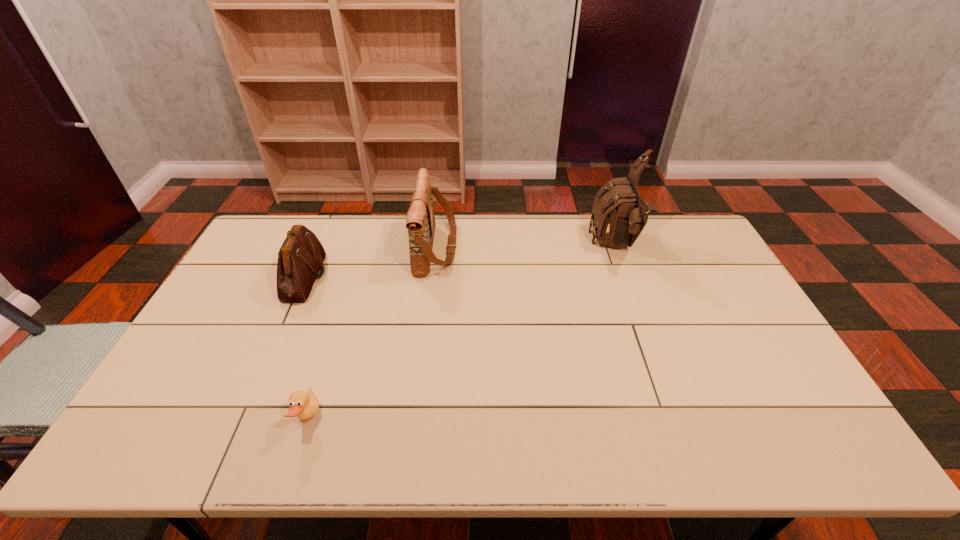
What are the coordinates of `free space located 0.110m on the front-facing side of the rightmost object` in the screenshot? It's located at (561, 246).

The height and width of the screenshot is (540, 960). In order to click on vacant region located 0.350m on the front-facing side of the second tallest shoulder bag in this screenshot , I will do `click(557, 248)`.

Locate an element on the screen. Image resolution: width=960 pixels, height=540 pixels. vacant space located on the front of the leftmost shoulder bag is located at coordinates (251, 403).

At what (x,y) coordinates should I click in order to perform the action: click on blank space located on the beak of the duck. Please return your answer as a coordinate pair (x, y). Looking at the image, I should click on (431, 418).

Locate an element on the screen. object positioned at the near edge is located at coordinates (305, 405).

In the image, there is a desktop. At what (x,y) coordinates should I click in order to perform the action: click on vacant space at the far edge. Please return your answer as a coordinate pair (x, y). The height and width of the screenshot is (540, 960). Looking at the image, I should click on (481, 242).

Where is `free space at the near edge`? The image size is (960, 540). free space at the near edge is located at coordinates (219, 442).

This screenshot has width=960, height=540. Identify the location of vacant space at the left edge of the desktop. (186, 357).

Where is `vacant space at the right edge`? vacant space at the right edge is located at coordinates (753, 341).

You are a GUI agent. You are given a task and a screenshot of the screen. Output one action in this format:
    pyautogui.click(x=<x>, y=<y>)
    Task: Click on the free space at the far left corner
    
    Given the screenshot: What is the action you would take?
    pyautogui.click(x=259, y=247)